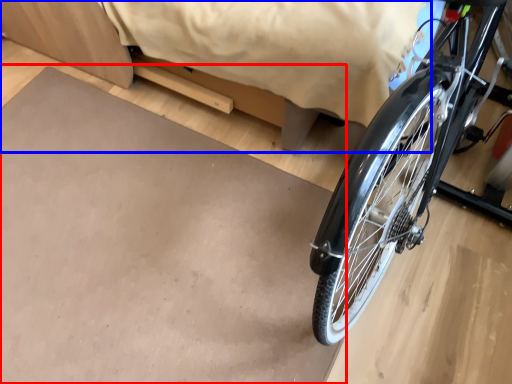
Question: Which object appears farthest to the camera in this image, slate (highlighted by a red box) or bed (highlighted by a blue box)?

Choices:
 (A) slate
 (B) bed

Answer: (A)